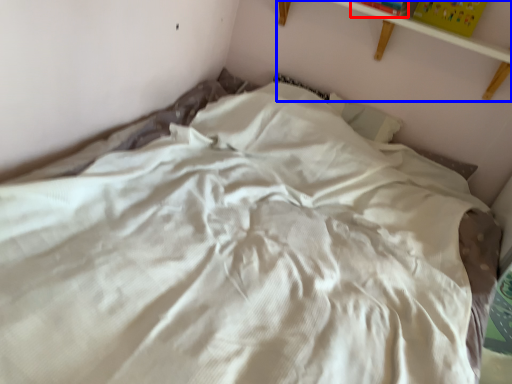
Question: Which point is closer to the camera, paperback book (highlighted by a red box) or shelf (highlighted by a blue box)?

Choices:
 (A) paperback book
 (B) shelf

Answer: (B)